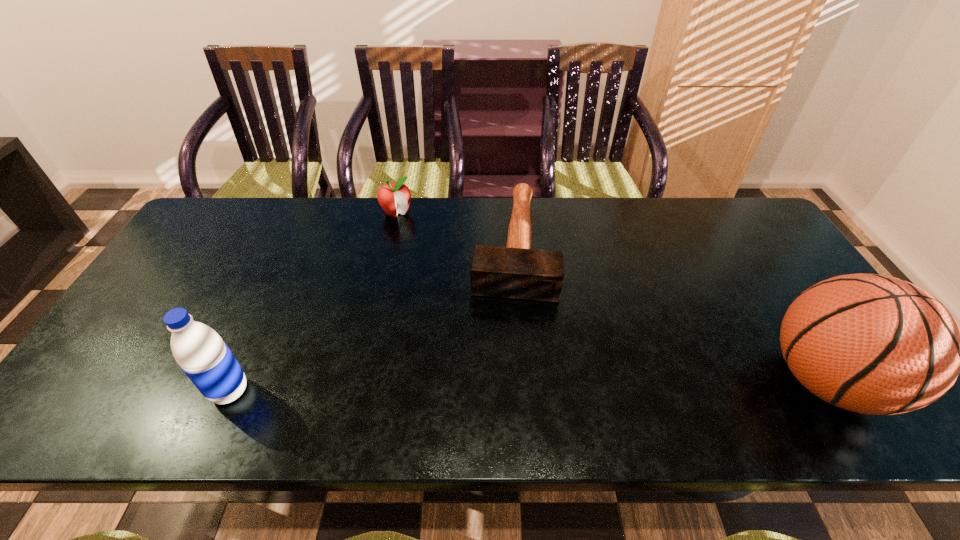
At what (x,y) coordinates should I click in order to perform the action: click on blank space that satisfies the following two spatial constraints: 1. on the front side of the second object from left to right; 2. on the side where the inflation valve is located. Please return your answer as a coordinate pair (x, y). Looking at the image, I should click on (360, 381).

In order to click on vacant region that satisfies the following two spatial constraints: 1. on the back side of the water bottle; 2. on the right side of the shortest object in this screenshot , I will do `click(295, 246)`.